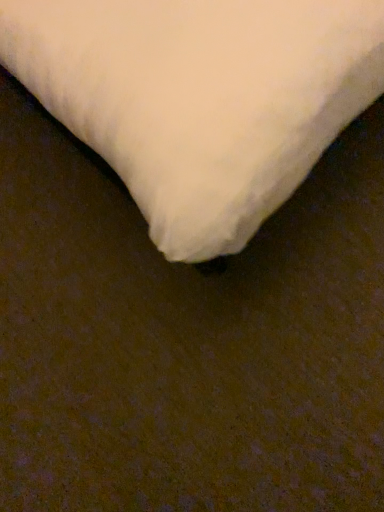
This screenshot has width=384, height=512. What do you see at coordinates (200, 98) in the screenshot?
I see `white soft pillow at upper center` at bounding box center [200, 98].

Locate an element on the screen. The height and width of the screenshot is (512, 384). white soft pillow at upper center is located at coordinates (200, 98).

In order to face white soft pillow at upper center, should I rotate leftwards or rightwards?

Turn left approximately 9.746 degrees to face it.

The height and width of the screenshot is (512, 384). What are the coordinates of `white soft pillow at upper center` in the screenshot? It's located at (200, 98).